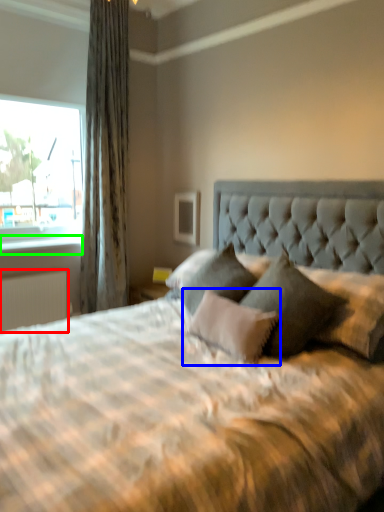
Question: Based on their relative distances, which object is farther from radiator (highlighted by a red box)? Choose from pillow (highlighted by a blue box) and window sill (highlighted by a green box).

Choices:
 (A) pillow
 (B) window sill

Answer: (A)